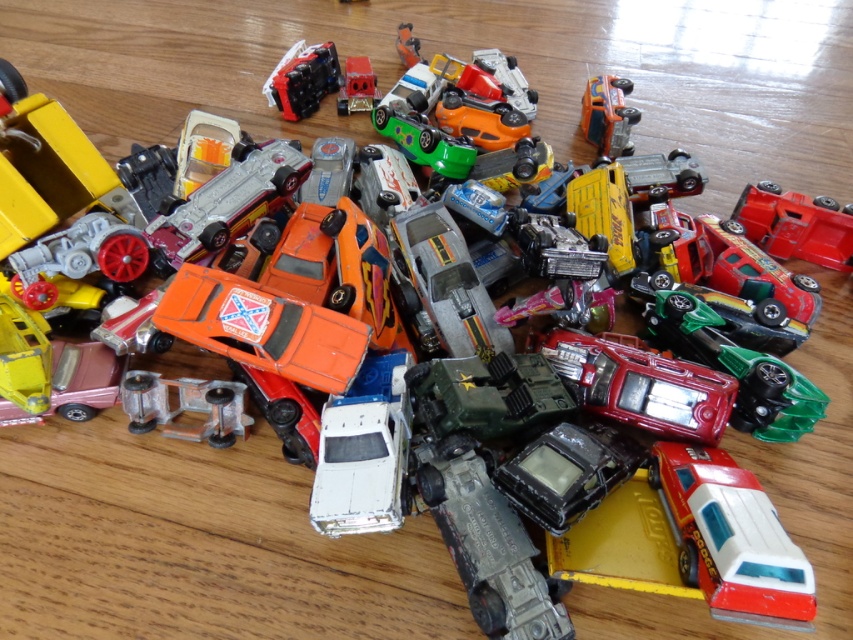
Consider the image. You are a photographer trying to capture a detailed shot of two specific points in the image. You want to focus on the point at (819, 252) and the point at (625, 92). Since you can only focus on one point clearly at a time, which point should you choose to ensure the other remains relatively sharp in the background?

You should focus on point (819, 252) because it is closer to the camera, so the farther point (625, 92) will be in the background and relatively sharp.

You are a toy collector standing at the edge of the wooden floor where the toy cars are scattered. You see two points marked on the floor at coordinates point (x=788, y=211) and point (x=318, y=93). If you want to reach both points to retrieve any toys there, which point should you go to first to minimize your walking distance?

You should go to point (x=318, y=93) first because it is closer to you than point (x=788, y=211), which is further away.

You are a child trying to organize your toy cars. You have a shiny plastic car at upper center and a shiny orange car at upper right. If you want to place them side by side on the shelf from left to right in the same order as they appear in the image, which car should you place first on the left side?

The shiny plastic car at upper center should be placed first on the left side because it is already positioned to the left of the shiny orange car at upper right in the image.